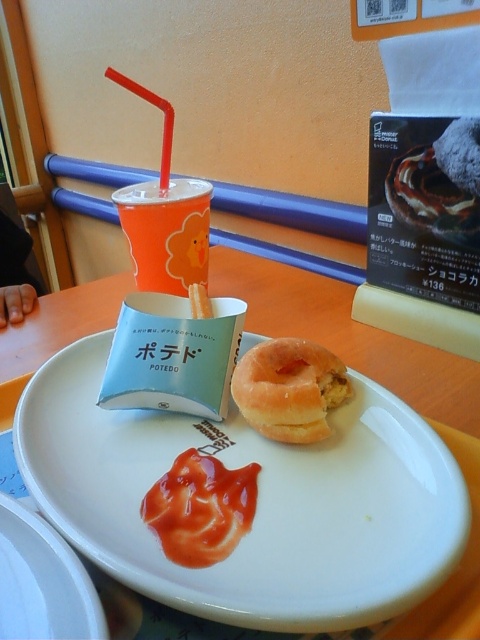
You are a food critic evaluating the presentation of this meal. The plate has both the tomato ketchup at center and the glazed doughnut at center. Which condiment takes up more space on the plate?

The glazed doughnut at center has a greater width than the tomato ketchup at center, so the doughnut occupies more space on the plate.

You are a food critic evaluating this meal. Based on the arrangement of the tomato ketchup at center and the glazed doughnut at center, which one is positioned higher on the plate?

The glazed doughnut at center is positioned higher than the tomato ketchup at center because the tomato ketchup at center is located below it.

You are a food critic sitting at the table. You want to take a photo of the glazed doughnut at center without the white glossy plate at center appearing in the frame. Is this possible?

The white glossy plate at center is closer to the viewer than the glazed doughnut at center. Therefore, it would block the view of the glazed doughnut at center, making it impossible to take a photo of the glazed doughnut at center without the white glossy plate at center appearing in the frame.